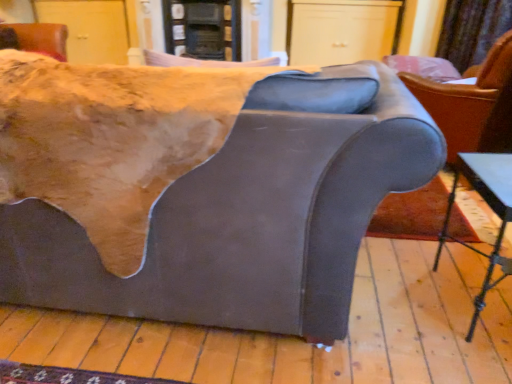
Question: In terms of width, does velvet curtain at upper right look wider or thinner when compared to suede-like gray couch at center?

Choices:
 (A) wide
 (B) thin

Answer: (B)

Question: Visually, is velvet curtain at upper right positioned to the left or to the right of suede-like gray couch at center?

Choices:
 (A) left
 (B) right

Answer: (B)

Question: Estimate the real-world distances between objects in this image. Which object is closer to the suede-like gray couch at center?

Choices:
 (A) velvet curtain at upper right
 (B) metallic silver table at lower right
 (C) matte gray armchair at right

Answer: (B)

Question: Estimate the real-world distances between objects in this image. Which object is farther from the metallic silver table at lower right?

Choices:
 (A) suede-like gray couch at center
 (B) matte gray armchair at right
 (C) velvet curtain at upper right

Answer: (C)